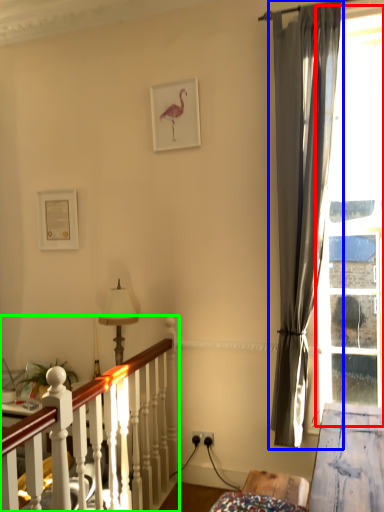
Question: Which object is positioned farthest from bay window (highlighted by a red box)? Select from curtain (highlighted by a blue box) and bed frame (highlighted by a green box).

Choices:
 (A) curtain
 (B) bed frame

Answer: (B)